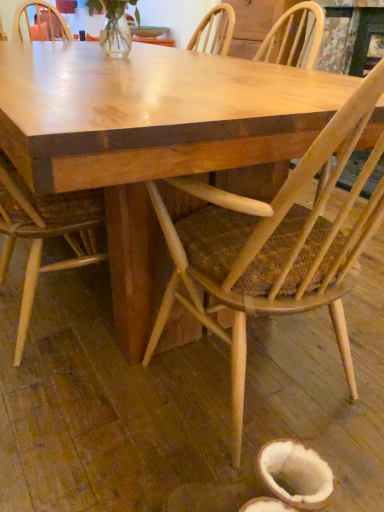
Where is `natural wood chair at center`? The width and height of the screenshot is (384, 512). natural wood chair at center is located at coordinates (274, 246).

Describe the element at coordinates (274, 246) in the screenshot. The image size is (384, 512). I see `natural wood chair at center` at that location.

This screenshot has height=512, width=384. What are the coordinates of `natural wood chair at center` in the screenshot? It's located at (274, 246).